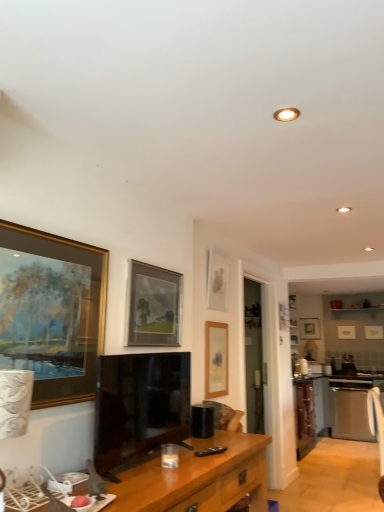
Find the location of a particular element. This screenshot has height=512, width=384. free space above wooden desk at lower center (from a real-world perspective) is located at coordinates (157, 459).